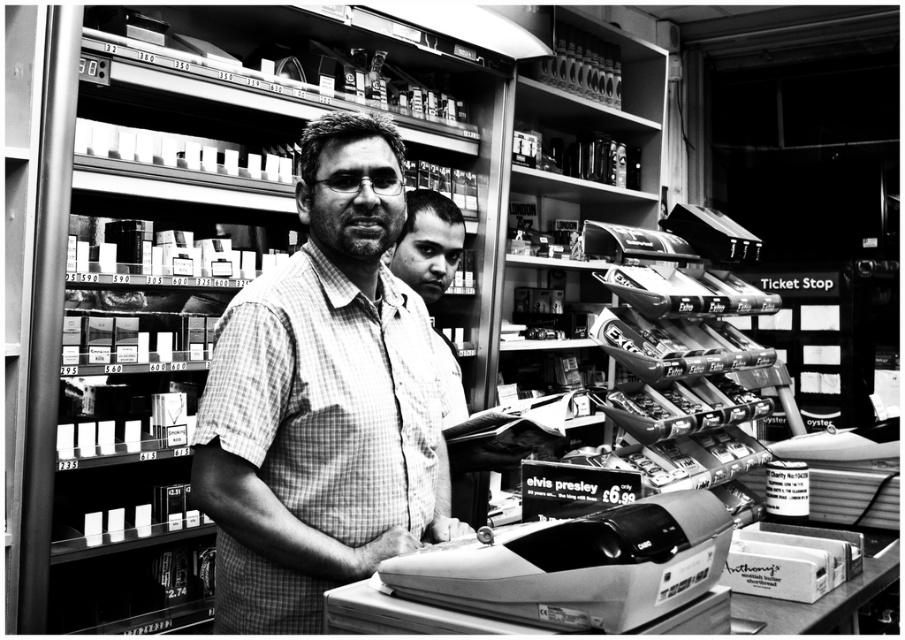
From the picture: Is checkered fabric shirt at center above metallic gray cash register at lower center?

Yes, checkered fabric shirt at center is above metallic gray cash register at lower center.

Does checkered fabric shirt at center have a greater width compared to metallic gray cash register at lower center?

In fact, checkered fabric shirt at center might be narrower than metallic gray cash register at lower center.

Which is in front, point (345, 332) or point (568, 524)?

Point (568, 524)

Identify the location of checkered fabric shirt at center. (322, 400).